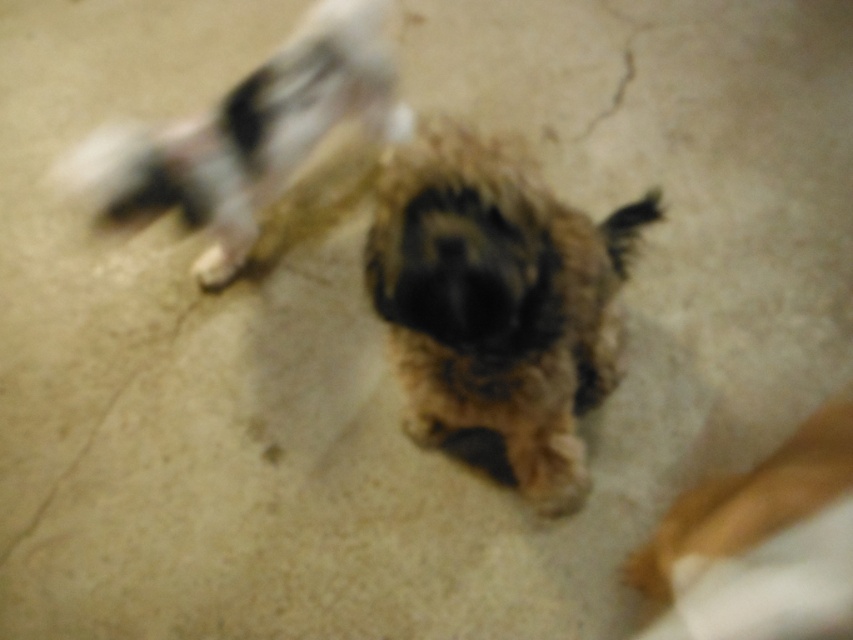
You are a photographer trying to capture a closeup shot of the brown fuzzy dog at center. The fuzzy brown paw at center is blocking the view. Can you move the paw to get a clear shot of the dog?

The distance between the brown fuzzy dog at center and the fuzzy brown paw at center is 3.74 feet. Since the paw is part of the dog, you can gently move the paw to get a clear shot of the dog.

You are a photographer trying to capture the exact spot where the dog is located in the image. The coordinates given are point [498,304]. Based on the scene description, can you confirm if this point is on the dog?

Yes, the point [498,304] is on the fuzzy brown dog at center as described in the Objects Description.